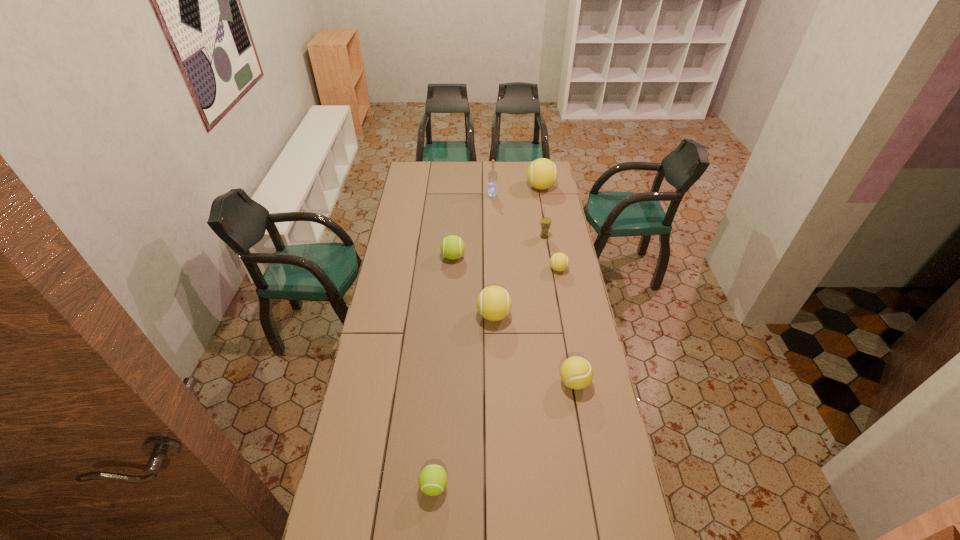
You are a GUI agent. You are given a task and a screenshot of the screen. Output one action in this format:
    pyautogui.click(x=<x>, y=<y>)
    Task: Click on the vacant space that's between the farther green tennis ball and the second biggest yellow tennis ball
    
    Given the screenshot: What is the action you would take?
    pyautogui.click(x=473, y=286)

Where is `unoccupied position between the sixth farthest object and the vodka`? This screenshot has width=960, height=540. unoccupied position between the sixth farthest object and the vodka is located at coordinates (493, 255).

Image resolution: width=960 pixels, height=540 pixels. I want to click on free spot between the bigger green tennis ball and the fifth shortest tennis ball, so click(x=473, y=286).

Identify the location of free space between the second farthest yellow tennis ball and the smaller green tennis ball. (496, 377).

This screenshot has height=540, width=960. I want to click on empty location between the biggest yellow tennis ball and the farther green tennis ball, so click(497, 222).

Locate an element on the screen. free space between the leftmost yellow tennis ball and the third nearest yellow tennis ball is located at coordinates (526, 292).

I want to click on vacant area that lies between the nearest tennis ball and the yellow straw for drinking, so click(x=490, y=361).

The height and width of the screenshot is (540, 960). Identify the location of vacant space that is in between the farther green tennis ball and the fifth shortest tennis ball. (473, 286).

At what (x,y) coordinates should I click in order to perform the action: click on the sixth closest object relative to the farthest tennis ball. Please return your answer as a coordinate pair (x, y). This screenshot has width=960, height=540. Looking at the image, I should click on point(576,372).

Choose which object is the fourth nearest neighbor to the fifth shortest tennis ball. Please provide its 2D coordinates. Your answer should be formatted as a tuple, i.e. [(x, y)], where the tuple contains the x and y coordinates of a point satisfying the conditions above.

[(545, 222)]